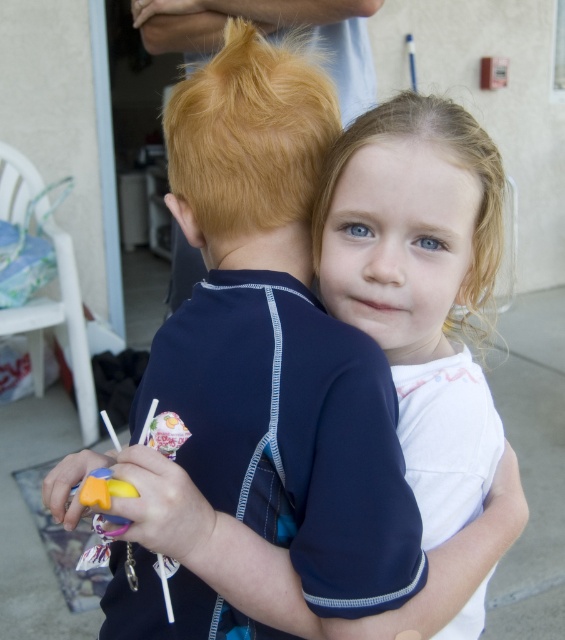
Looking at this image, you are a photographer trying to capture both children in a photo. Given that the blonde shiny hair at upper center and the blonde curly hair at upper right are both important for the composition, which child should you focus on to ensure their hair is clearly visible in the frame?

The blonde shiny hair at upper center is larger in size than the blonde curly hair at upper right, so focusing on the child with the blonde shiny hair at upper center will ensure their hair is more clearly visible in the photo.